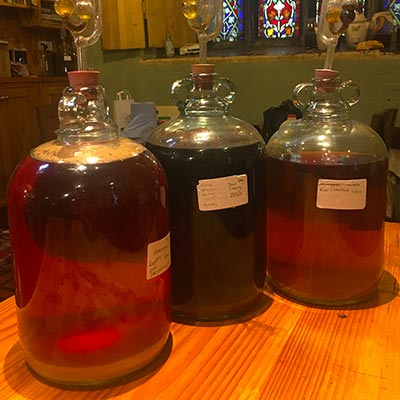
Identify the location of wooden cabinets. (19, 28), (16, 80), (15, 126), (45, 86), (43, 123), (33, 104).